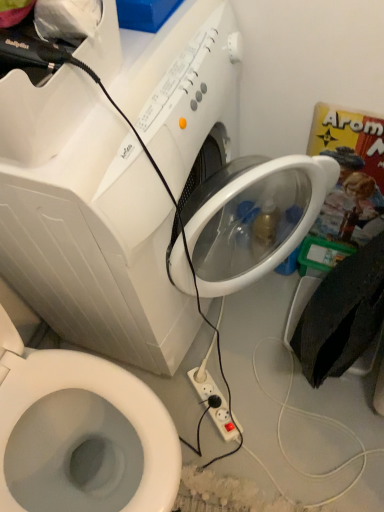
Question: From a real-world perspective, is white plastic bidet at lower left positioned above or below white plastic washing machine at upper center?

Choices:
 (A) above
 (B) below

Answer: (B)

Question: Is white plastic bidet at lower left wider or thinner than white plastic washing machine at upper center?

Choices:
 (A) thin
 (B) wide

Answer: (B)

Question: Which is farther from the white plastic bidet at lower left?

Choices:
 (A) white plastic washing machine at upper center
 (B) white plastic power plugs and sockets at lower center

Answer: (B)

Question: Considering the real-world distances, which object is farthest from the white plastic washing machine at upper center?

Choices:
 (A) white plastic bidet at lower left
 (B) white plastic power plugs and sockets at lower center

Answer: (B)